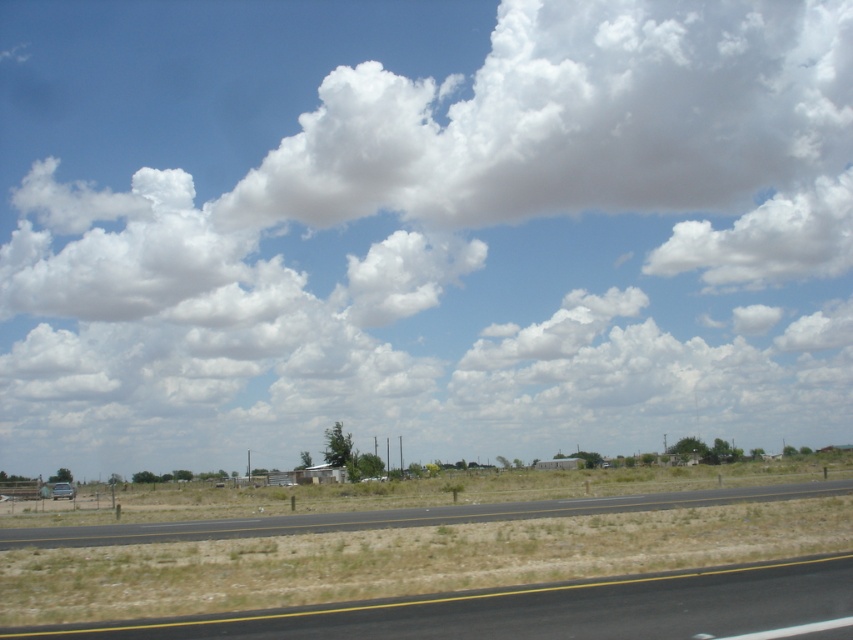
Which is below, white fluffy cloud at upper center or asphalt road at lower center?

asphalt road at lower center is below.

Is point (662, 81) farther from viewer compared to point (833, 493)?

Yes, it is.

The image size is (853, 640). Find the location of `white fluffy cloud at upper center`. white fluffy cloud at upper center is located at coordinates (421, 227).

Is point (231, 522) farther from viewer compared to point (74, 492)?

No, it is in front of (74, 492).

This screenshot has height=640, width=853. I want to click on asphalt road at lower center, so click(402, 516).

Between black asphalt road at lower center and clear glass window at lower left, which one appears on the left side from the viewer's perspective?

Positioned to the left is clear glass window at lower left.

Is point (321, 634) less distant than point (67, 486)?

Yes, point (321, 634) is in front of point (67, 486).

Locate an element on the screen. The image size is (853, 640). black asphalt road at lower center is located at coordinates (537, 609).